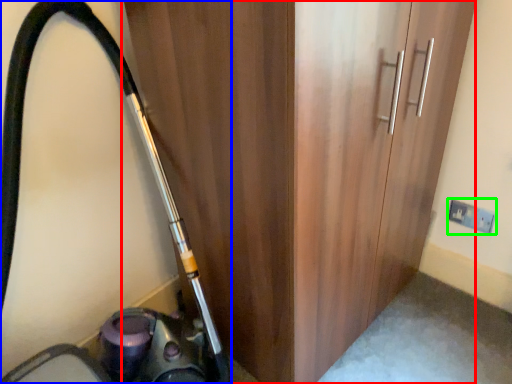
Question: Which object is the farthest from door (highlighted by a red box)? Choose among these: equipment (highlighted by a blue box) or electric outlet (highlighted by a green box).

Choices:
 (A) equipment
 (B) electric outlet

Answer: (B)